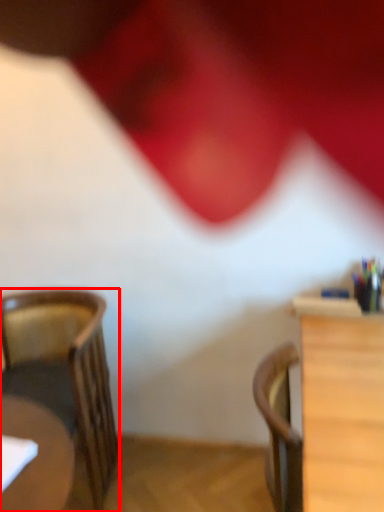
Question: Where is chair (annotated by the red box) located in relation to table in the image?

Choices:
 (A) right
 (B) left

Answer: (B)